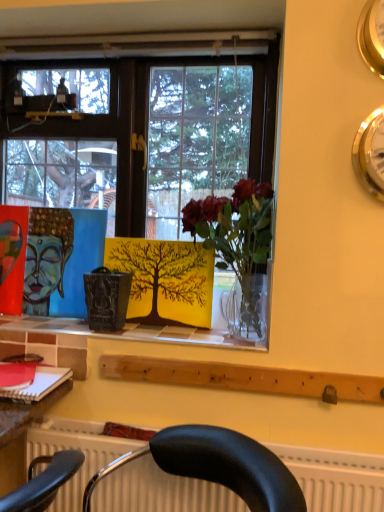
You are a GUI agent. You are given a task and a screenshot of the screen. Output one action in this format:
    pyautogui.click(x=<x>, y=<y>)
    Task: Click on the vacant area on top of matte red book at lower left (from a real-world perspective)
    
    Given the screenshot: What is the action you would take?
    click(x=17, y=370)